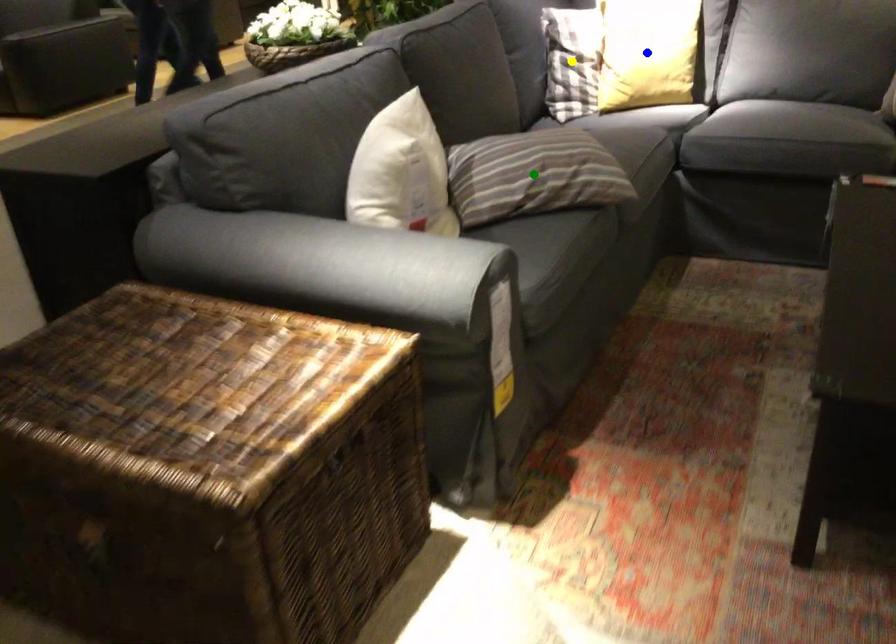
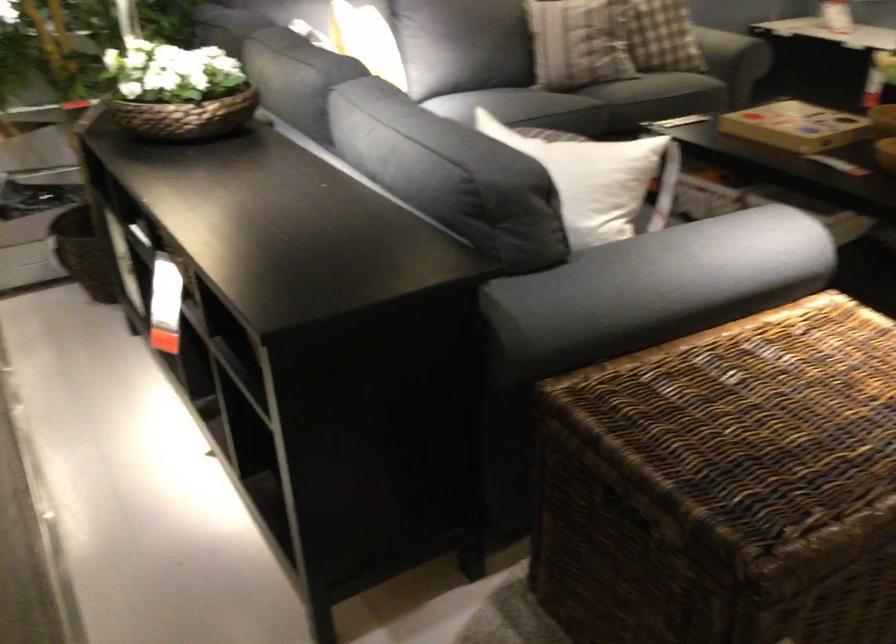
I am providing you with two images of the same scene from different viewpoints. Three points are marked in image1. Which point corresponds to a part or object that is occluded in image2?In image1, three points are marked. Which of them correspond to a part or object that is occluded in image2?Among the three points shown in image1, which one corresponds to a part or object that is no longer visible due to occlusion in image2?

green point, blue point, yellow point cannot be seen in image2.